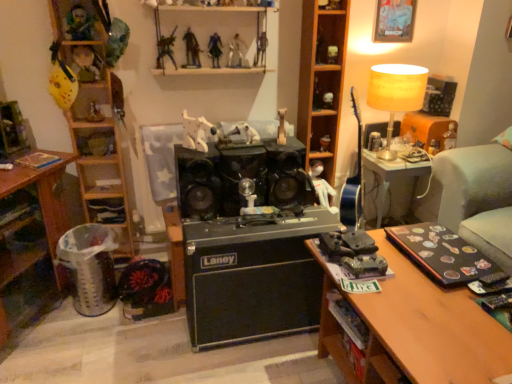
Question: Is wooden shelf at upper left, arranged as the 5th shelf when viewed from the right, positioned beyond the bounds of green matte toy tank at center, which is the 11th toy from left to right?

Choices:
 (A) yes
 (B) no

Answer: (A)

Question: Does wooden shelf at upper left, positioned as the 1th shelf in left-to-right order, have a greater width compared to green matte toy tank at center, the fifth toy when ordered from right to left?

Choices:
 (A) no
 (B) yes

Answer: (A)

Question: From a real-world perspective, is wooden shelf at upper left, positioned as the 1th shelf in left-to-right order, positioned over green matte toy tank at center, the fifth toy when ordered from right to left, based on gravity?

Choices:
 (A) yes
 (B) no

Answer: (A)

Question: From the image's perspective, is wooden shelf at upper left, positioned as the 1th shelf in left-to-right order, on top of green matte toy tank at center, the fifth toy when ordered from right to left?

Choices:
 (A) no
 (B) yes

Answer: (B)

Question: Does wooden shelf at upper left, positioned as the 1th shelf in left-to-right order, have a greater height compared to green matte toy tank at center, the fifth toy when ordered from right to left?

Choices:
 (A) yes
 (B) no

Answer: (A)

Question: From the image's perspective, is metallic silver robot at upper center, the 12th toy from the right, located beneath white matte figurine at upper center, acting as the fourteenth toy starting from the left?

Choices:
 (A) yes
 (B) no

Answer: (B)

Question: Does metallic silver robot at upper center, which is the fourth toy from left to right, come behind white matte figurine at upper center, the second toy in the right-to-left sequence?

Choices:
 (A) no
 (B) yes

Answer: (A)

Question: Can you confirm if metallic silver robot at upper center, the 12th toy from the right, is positioned to the right of white matte figurine at upper center, acting as the fourteenth toy starting from the left?

Choices:
 (A) no
 (B) yes

Answer: (A)

Question: From a real-world perspective, is metallic silver robot at upper center, the 12th toy from the right, beneath white matte figurine at upper center, acting as the fourteenth toy starting from the left?

Choices:
 (A) yes
 (B) no

Answer: (B)

Question: Does metallic silver robot at upper center, which is the fourth toy from left to right, appear on the left side of white matte figurine at upper center, acting as the fourteenth toy starting from the left?

Choices:
 (A) yes
 (B) no

Answer: (A)

Question: Is metallic silver robot at upper center, the 12th toy from the right, not within white matte figurine at upper center, acting as the fourteenth toy starting from the left?

Choices:
 (A) yes
 (B) no

Answer: (A)

Question: From a real-world perspective, is wooden shelf at lower left, which is the 2th shelf in left-to-right order, located beneath metallic silver toy at right, which is counted as the fifteenth toy, starting from the left?

Choices:
 (A) no
 (B) yes

Answer: (B)